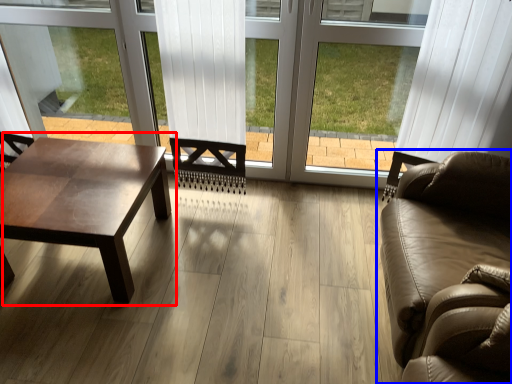
Question: Among these objects, which one is nearest to the camera, coffee table (highlighted by a red box) or studio couch (highlighted by a blue box)?

Choices:
 (A) coffee table
 (B) studio couch

Answer: (B)